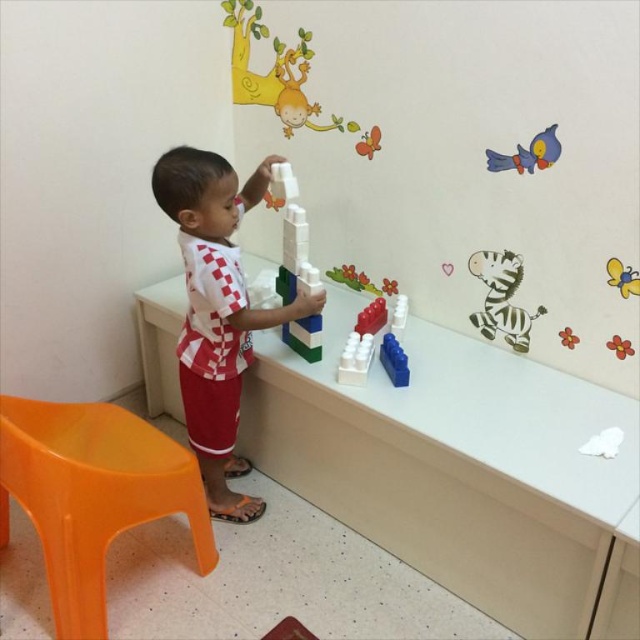
Question: Which point is farther from the camera taking this photo?

Choices:
 (A) (403, 365)
 (B) (339, 280)
 (C) (108, 417)

Answer: (B)

Question: Is white plastic blocks at center positioned at the back of translucent plastic toy at center?

Choices:
 (A) no
 (B) yes

Answer: (A)

Question: Is orange plastic chair at lower left bigger than white plastic blocks at center?

Choices:
 (A) yes
 (B) no

Answer: (A)

Question: Which object is closer to the camera taking this photo?

Choices:
 (A) white matte zebra at upper right
 (B) white matte blocks at center

Answer: (B)

Question: Does orange plastic chair at lower left have a larger size compared to blue plastic blocks at lower right?

Choices:
 (A) yes
 (B) no

Answer: (A)

Question: Estimate the real-world distances between objects in this image. Which object is closer to the white plastic blocks at center?

Choices:
 (A) white matte zebra at upper right
 (B) white matte blocks at center

Answer: (B)